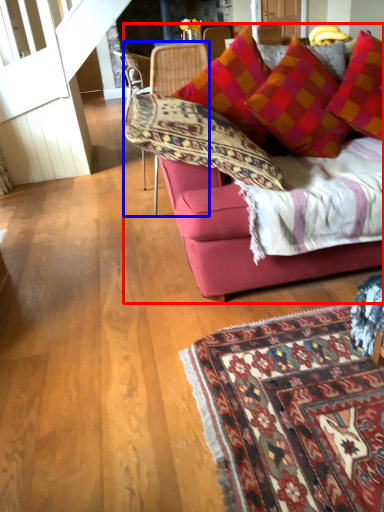
Question: Which object appears farthest to the camera in this image, studio couch (highlighted by a red box) or chair (highlighted by a blue box)?

Choices:
 (A) studio couch
 (B) chair

Answer: (B)